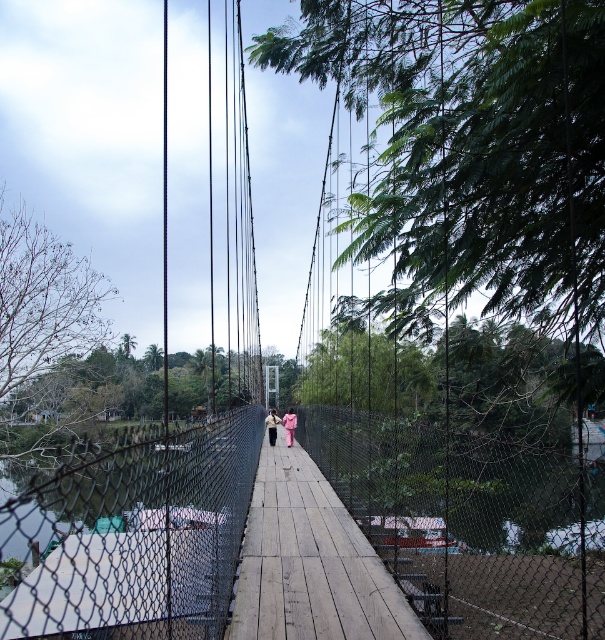
Question: Is pink fabric at center thinner than light brown fabric jacket at center?

Choices:
 (A) no
 (B) yes

Answer: (B)

Question: Which object appears farthest from the camera in this image?

Choices:
 (A) light brown fabric jacket at center
 (B) pink fabric at center

Answer: (A)

Question: Among these points, which one is farthest from the camera?

Choices:
 (A) (273, 419)
 (B) (287, 435)

Answer: (A)

Question: Is pink fabric at center below light brown fabric jacket at center?

Choices:
 (A) no
 (B) yes

Answer: (A)

Question: Is pink fabric at center positioned at the back of light brown fabric jacket at center?

Choices:
 (A) no
 (B) yes

Answer: (A)